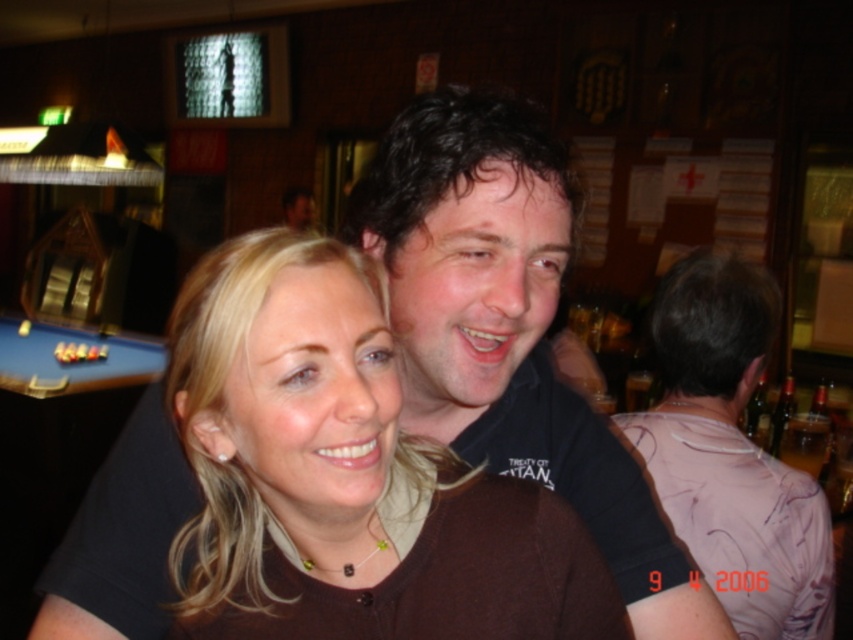
You are trying to decide whether to place a rectangular box on the blue felt pool table at lower left or on the brown matte shirt at center. Which surface can accommodate a taller object?

The blue felt pool table at lower left can accommodate a taller object because the brown matte shirt at center is not as tall as the blue felt pool table at lower left.

You are at a bar and need to place a small drink coaster between the brown matte shirt at center and the blue felt pool table at lower left. Based on their positions, where should you place it?

The brown matte shirt at center is located below the blue felt pool table at lower left, so you should place the coaster between them in the space between the shirt and the pool table.

You are standing in a bar and want to take a photo of the point at coordinates point (432, 600). The camera you are using has a minimum focus distance of 20 inches. Will you be able to focus on the point?

The point (432, 600) is 21.53 inches away from you, which is beyond the camera minimum focus distance of 20 inches. Therefore, you should be able to focus on the point.